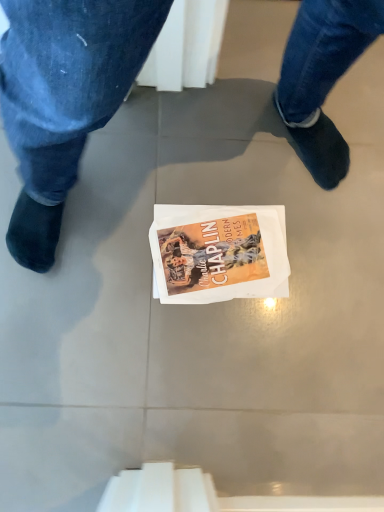
In the scene shown: Measure the distance between orange matte paper at center and camera.

orange matte paper at center is 35.79 inches away from camera.

Describe the element at coordinates (218, 254) in the screenshot. I see `orange matte paper at center` at that location.

Where is `orange matte paper at center`? orange matte paper at center is located at coordinates (218, 254).

You are a GUI agent. You are given a task and a screenshot of the screen. Output one action in this format:
    pyautogui.click(x=<x>, y=<y>)
    Task: Click on the orange matte paper at center
    Image resolution: width=384 pixels, height=512 pixels.
    Given the screenshot: What is the action you would take?
    pyautogui.click(x=218, y=254)